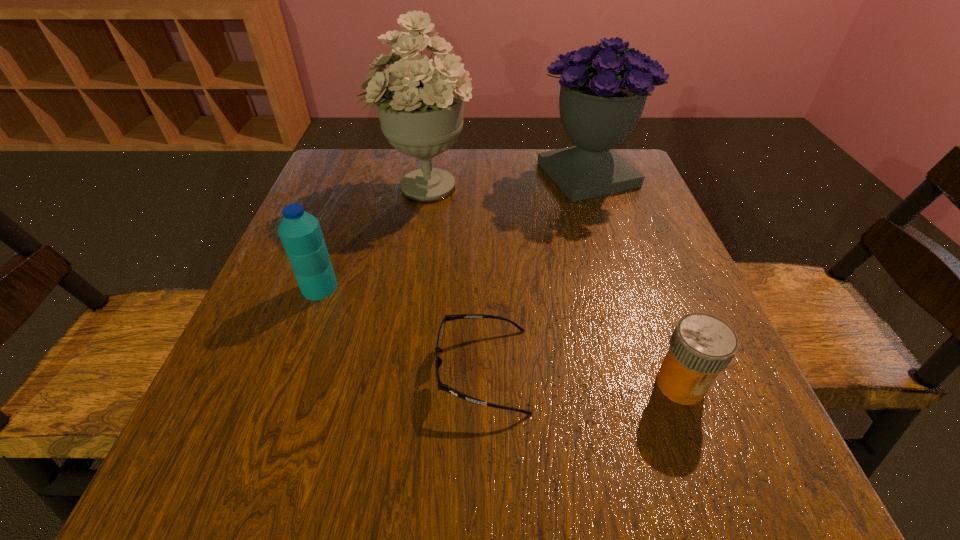
The image size is (960, 540). I want to click on free space located 0.050m on the label side of the medicine, so click(x=702, y=441).

Identify the location of vacant space located on the front-facing side of the sunglasses. (341, 370).

You are a GUI agent. You are given a task and a screenshot of the screen. Output one action in this format:
    pyautogui.click(x=<x>, y=<y>)
    Task: Click on the free space located on the front-facing side of the sunglasses
    
    Given the screenshot: What is the action you would take?
    pyautogui.click(x=230, y=370)

The width and height of the screenshot is (960, 540). Identify the location of blank space located 0.120m on the front-facing side of the sunglasses. (360, 370).

Find the location of a particular element. The width and height of the screenshot is (960, 540). bouquet at the left edge is located at coordinates (420, 102).

Locate an element on the screen. water bottle present at the left edge is located at coordinates (300, 232).

Image resolution: width=960 pixels, height=540 pixels. Find the location of `bouquet that is at the right edge`. bouquet that is at the right edge is located at coordinates [604, 88].

The image size is (960, 540). What are the coordinates of `medicine that is at the right edge` in the screenshot? It's located at (701, 346).

Identify the location of object located in the far left corner section of the desktop. (420, 102).

Find the location of a particular element. Image resolution: width=960 pixels, height=540 pixels. object positioned at the far right corner is located at coordinates (604, 88).